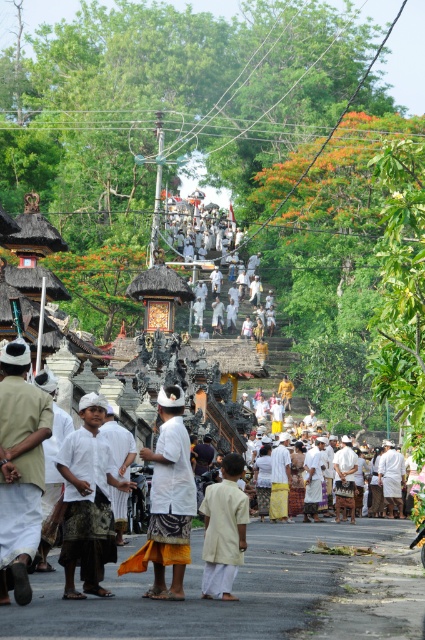
You are a photographer standing at the camera position. You want to capture a closeup shot of the light beige cotton shirt at left. Based on the distance provided, is it feasible to take a clear closeup photo without moving closer?

The light beige cotton shirt at left is 38.84 meters away from the camera. At this distance, taking a clear closeup photo without moving closer would be challenging unless using a high quality zoom lens capable of magnifying distant subjects sufficiently.

You are a photographer trying to capture a balanced composition. You notice the light beige cotton shirt at left and the light beige fabric at center in the scene. Which object should you focus on to ensure symmetry in your photo?

The light beige cotton shirt at left might be wider than light beige fabric at center, so focusing on the light beige cotton shirt at left could help achieve symmetry by balancing the visual weight.